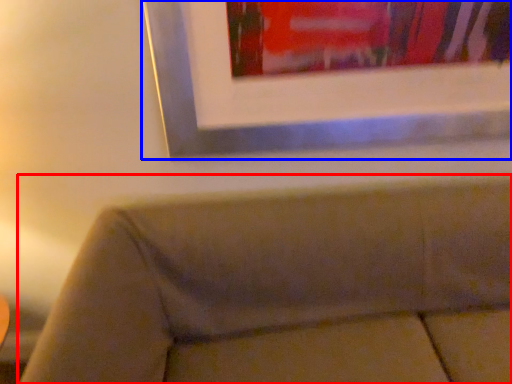
Question: Among these objects, which one is farthest to the camera, studio couch (highlighted by a red box) or picture frame (highlighted by a blue box)?

Choices:
 (A) studio couch
 (B) picture frame

Answer: (B)